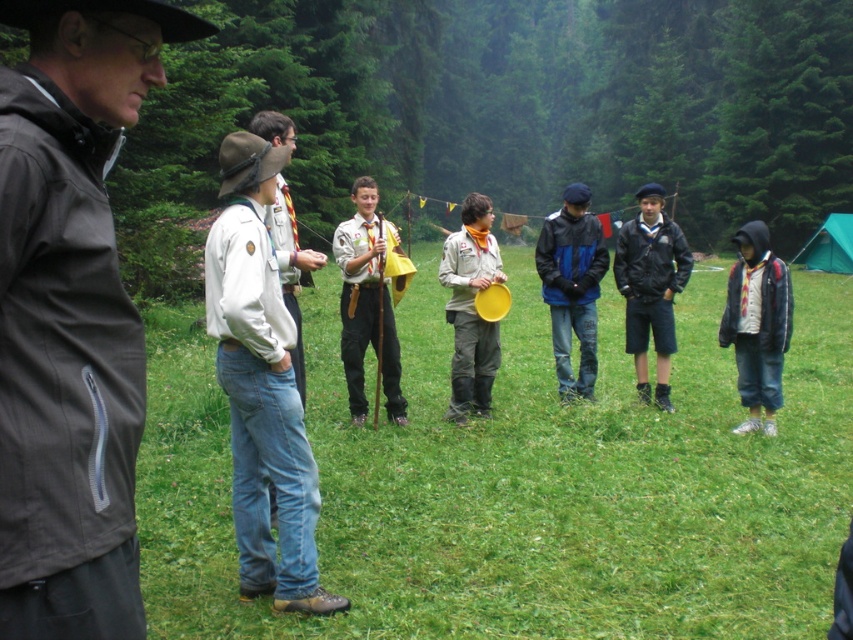
Question: Which point is closer to the camera taking this photo?

Choices:
 (A) (276, 262)
 (B) (747, 232)

Answer: (A)

Question: Is white uniform at center smaller than matte gray hoodie at right?

Choices:
 (A) no
 (B) yes

Answer: (A)

Question: In this image, where is white uniform at center located relative to matte yellow frisbee at center?

Choices:
 (A) left
 (B) right

Answer: (A)

Question: Does matte gray hoodie at right lie in front of matte yellow frisbee at center?

Choices:
 (A) no
 (B) yes

Answer: (A)

Question: Which point is farther to the camera?

Choices:
 (A) (743, 262)
 (B) (480, 410)
 (C) (815, 266)
 (D) (109, 568)

Answer: (C)

Question: Which object is the farthest from the white uniform at center?

Choices:
 (A) green grass at center
 (B) matte gray hoodie at right
 (C) green canvas tent at right
 (D) dark brown jacket at left

Answer: (C)